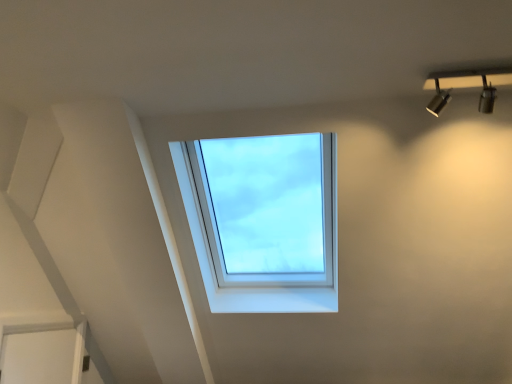
What do you see at coordinates (467, 86) in the screenshot?
I see `metallic silver spotlight at upper right` at bounding box center [467, 86].

The image size is (512, 384). Identify the location of metallic silver spotlight at upper right. (467, 86).

Measure the distance between metallic silver spotlight at upper right and camera.

The distance of metallic silver spotlight at upper right from camera is 1.44 meters.

Where is `metallic silver spotlight at upper right`? This screenshot has height=384, width=512. metallic silver spotlight at upper right is located at coordinates (467, 86).